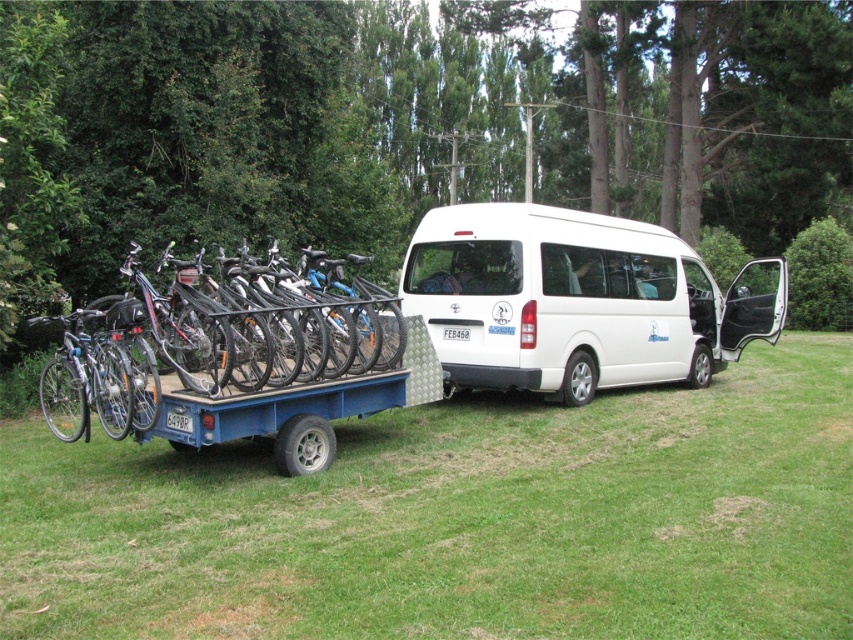
Question: Which of these objects is positioned closest to the shiny metallic bicycle at left?

Choices:
 (A) white matte van at center
 (B) matte black bicycle at left
 (C) green grass at lower center

Answer: (B)

Question: Which object is positioned farthest from the green grass at lower center?

Choices:
 (A) shiny metallic bicycle at left
 (B) white matte van at center
 (C) matte black bicycle at left

Answer: (B)

Question: Which point is farther to the camera?

Choices:
 (A) (728, 360)
 (B) (80, 326)

Answer: (A)

Question: Is green grass at lower center below white matte van at center?

Choices:
 (A) no
 (B) yes

Answer: (B)

Question: Does green grass at lower center have a greater width compared to white matte van at center?

Choices:
 (A) no
 (B) yes

Answer: (A)

Question: Is white matte van at center to the left of matte black bicycle at left from the viewer's perspective?

Choices:
 (A) no
 (B) yes

Answer: (A)